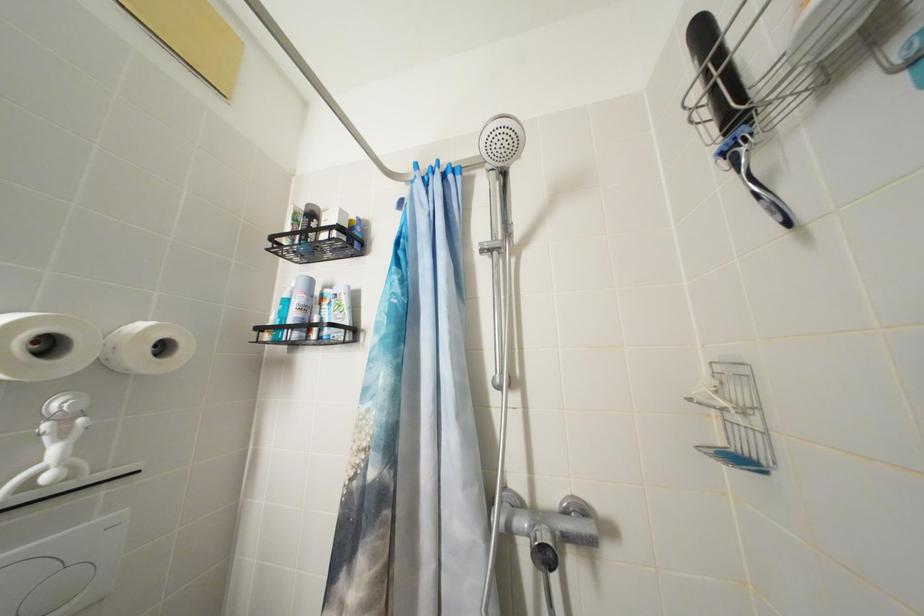
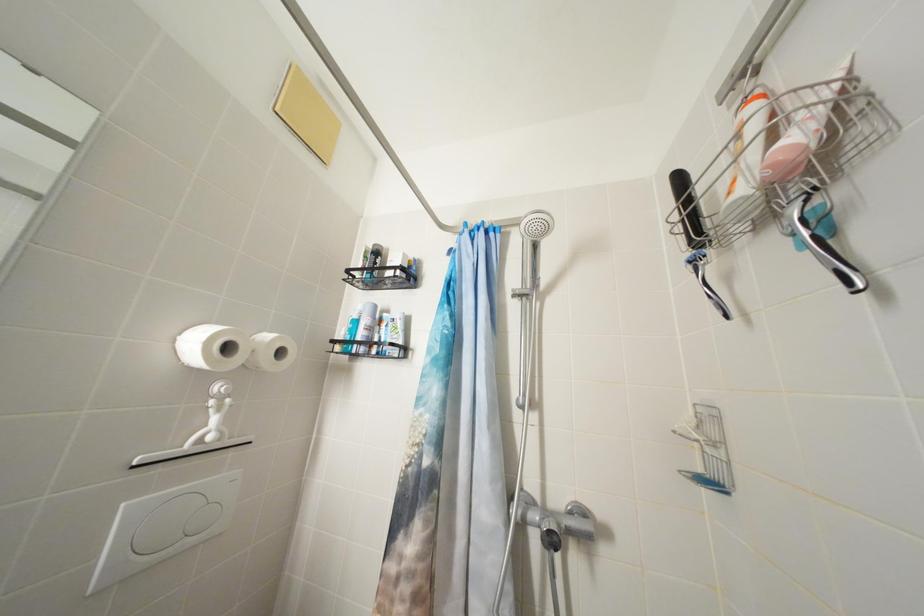
Question: How did the camera likely rotate?

Choices:
 (A) Left
 (B) Right
 (C) Up
 (D) Down

Answer: (A)